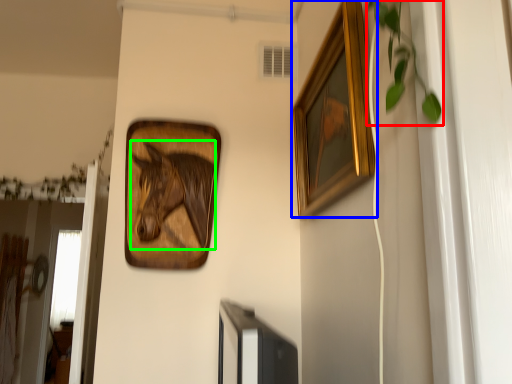
Question: Which object is the closest to the plant (highlighted by a red box)? Choose among these: picture frame (highlighted by a blue box) or animal (highlighted by a green box).

Choices:
 (A) picture frame
 (B) animal

Answer: (A)